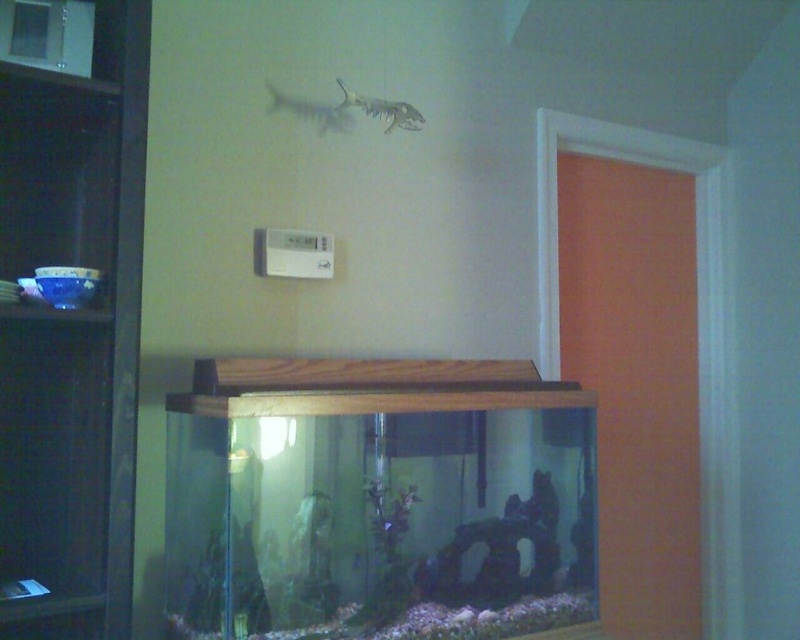
In the scene shown: You are standing in the room and want to place a new decoration on the dark wood bookshelf at left. However, you notice the translucent plastic fish at upper center. Can you place the decoration on the bookshelf without blocking the view of the fish?

The dark wood bookshelf at left is in front of the translucent plastic fish at upper center, so placing a decoration on the bookshelf would block the view of the fish since the bookshelf is closer to you.

You are trying to hang a new picture frame on the wall between the dark wood bookshelf at left and the translucent plastic fish at upper center. The frame is 1.2 meters wide. Is there enough space between them for the frame?

The dark wood bookshelf at left is much taller than the translucent plastic fish at upper center, so there is sufficient vertical space between them to hang a 1.2 meter wide picture frame.

You are standing in the room and want to place a new aquarium decoration. The fish tank is in the center. You have a small statue that needs to be placed exactly at the point marked by coordinates point (72,330). Is this point located to the left or right of the fish tank?

The point (72,330) corresponds to the dark wood bookshelf at left, so placing the statue there would be to the left of the fish tank.